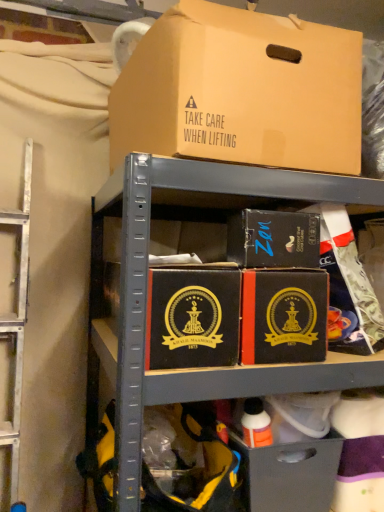
Question: Do you think black matte box at center, the 1th box from the bottom, is within matte black box at center, placed as the 2th box when sorted from top to bottom, or outside of it?

Choices:
 (A) outside
 (B) inside

Answer: (A)

Question: Is point (208, 350) closer or farther from the camera than point (243, 233)?

Choices:
 (A) closer
 (B) farther

Answer: (A)

Question: Estimate the real-world distances between objects in this image. Which object is farther from the brown cardboard box at upper center, placed as the 3th box when sorted from bottom to top?

Choices:
 (A) black matte box at center, which is the 3th box in top-to-bottom order
 (B) matte black drawer at lower center
 (C) matte black box at center, placed as the 2th box when sorted from top to bottom

Answer: (B)

Question: Estimate the real-world distances between objects in this image. Which object is farther from the brown cardboard box at upper center, placed as the 3th box when sorted from bottom to top?

Choices:
 (A) matte black drawer at lower center
 (B) matte black box at center, placed as the 2th box when sorted from top to bottom
 (C) black matte box at center, which is the 3th box in top-to-bottom order

Answer: (A)